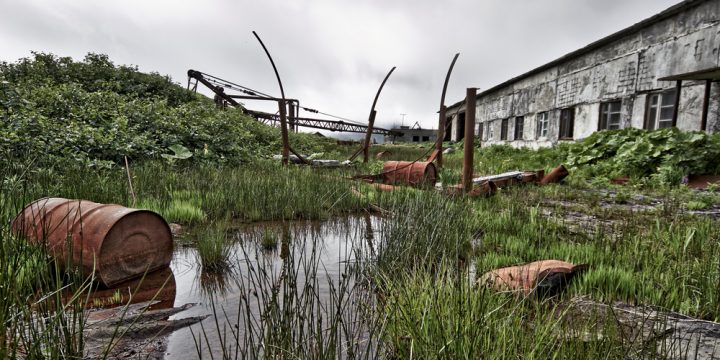
Locate an element on the screen. The width and height of the screenshot is (720, 360). window is located at coordinates (505, 124), (517, 129), (543, 126), (606, 117), (657, 99), (567, 125).